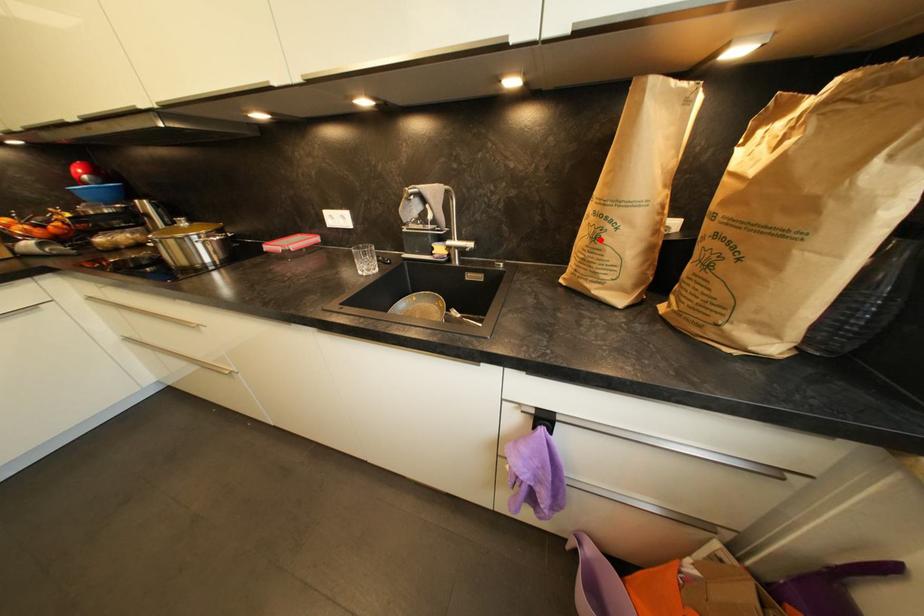
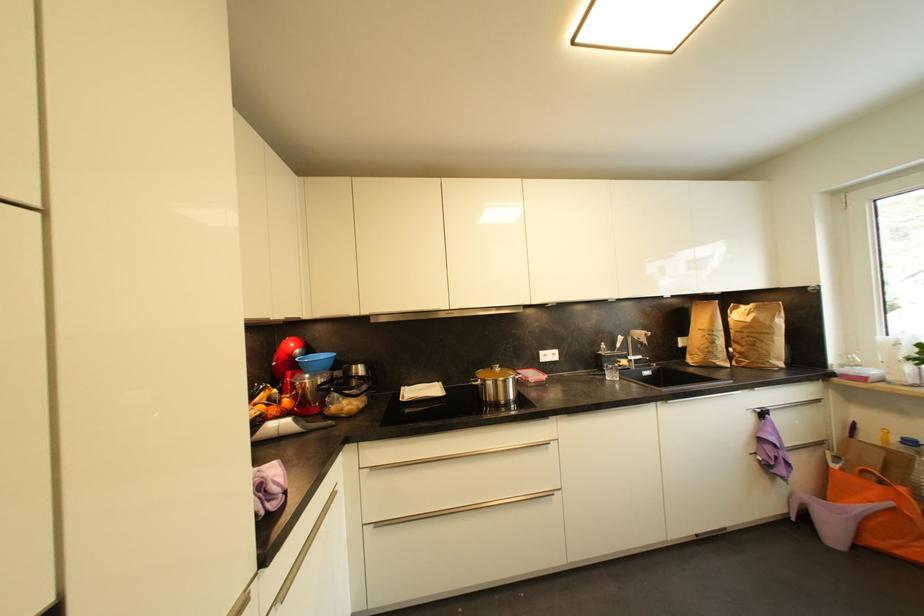
In the second image, find the point that corresponds to the highlighted location in the first image.

(718, 345)